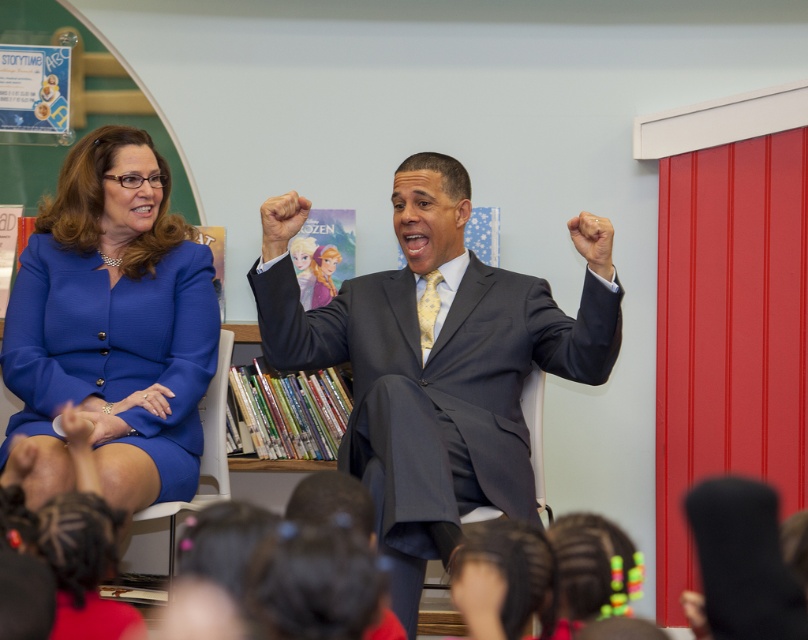
Question: Can you confirm if blue fabric dress at left is smaller than smooth skin hand at upper center?

Choices:
 (A) yes
 (B) no

Answer: (B)

Question: Which object appears closest to the camera in this image?

Choices:
 (A) smooth skin hand at upper center
 (B) blue fabric dress at left
 (C) matte gray suit at center

Answer: (B)

Question: Is matte gray suit at center to the left of blue fabric dress at left from the viewer's perspective?

Choices:
 (A) no
 (B) yes

Answer: (A)

Question: Estimate the real-world distances between objects in this image. Which object is farther from the smooth skin hand at upper center?

Choices:
 (A) blue fabric dress at left
 (B) matte gray suit at center

Answer: (A)

Question: Which object is the farthest from the matte gray suit at center?

Choices:
 (A) blue fabric dress at left
 (B) smooth skin hand at upper center

Answer: (A)

Question: Can you confirm if blue fabric dress at left is positioned below smooth skin hand at upper center?

Choices:
 (A) no
 (B) yes

Answer: (B)